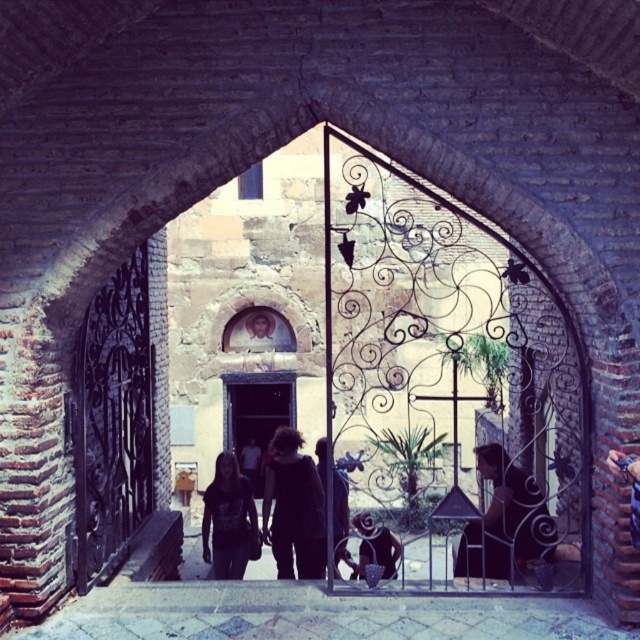
Can you confirm if dark wrought iron gate at left is positioned to the right of dark blue fabric at center?

Incorrect, dark wrought iron gate at left is not on the right side of dark blue fabric at center.

Can you confirm if dark wrought iron gate at left is shorter than dark blue fabric at center?

Yes, dark wrought iron gate at left is shorter than dark blue fabric at center.

Describe the element at coordinates (113, 420) in the screenshot. The height and width of the screenshot is (640, 640). I see `dark wrought iron gate at left` at that location.

Identify the location of dark wrought iron gate at left. The image size is (640, 640). (113, 420).

Is the position of dark gray fabric at center more distant than that of dark blue fabric at center?

Yes.

Can you confirm if dark gray fabric at center is positioned to the left of dark blue fabric at center?

Indeed, dark gray fabric at center is positioned on the left side of dark blue fabric at center.

Who is more distant from viewer, (212, 566) or (380, 561)?

Point (212, 566)

Image resolution: width=640 pixels, height=640 pixels. Identify the location of dark gray fabric at center. (228, 520).

The height and width of the screenshot is (640, 640). Describe the element at coordinates (113, 420) in the screenshot. I see `dark wrought iron gate at left` at that location.

Does dark wrought iron gate at left lie in front of dark hair at center?

Yes, dark wrought iron gate at left is in front of dark hair at center.

Where is `dark wrought iron gate at left`? dark wrought iron gate at left is located at coordinates (113, 420).